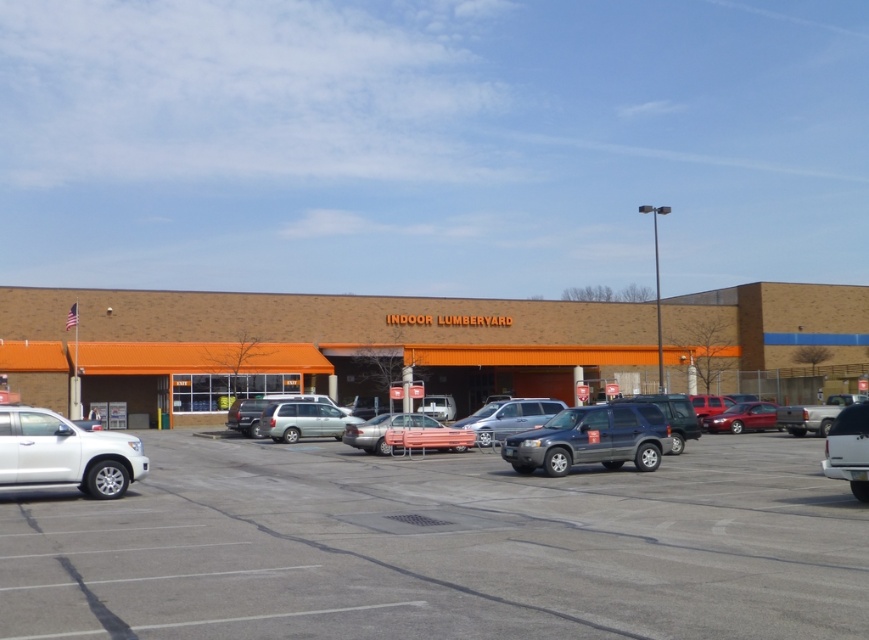
Question: Which point is closer to the camera?

Choices:
 (A) (310, 424)
 (B) (536, 442)
 (C) (866, 468)

Answer: (C)

Question: Which point is closer to the camera?

Choices:
 (A) satin silver minivan at center
 (B) shiny red sedan at right

Answer: (A)

Question: Can you confirm if gray asphalt parking lot at center is bigger than shiny red sedan at right?

Choices:
 (A) no
 (B) yes

Answer: (B)

Question: Considering the relative positions of matte gray suv at center and metallic silver car at center in the image provided, where is matte gray suv at center located with respect to metallic silver car at center?

Choices:
 (A) left
 (B) right

Answer: (B)

Question: Which object is closer to the camera taking this photo?

Choices:
 (A) gray asphalt parking lot at center
 (B) brown brick mall at center
 (C) white matte truck at lower right
 (D) matte gray suv at center

Answer: (A)

Question: Does white matte suv at lower left have a lesser width compared to shiny red sedan at right?

Choices:
 (A) no
 (B) yes

Answer: (A)